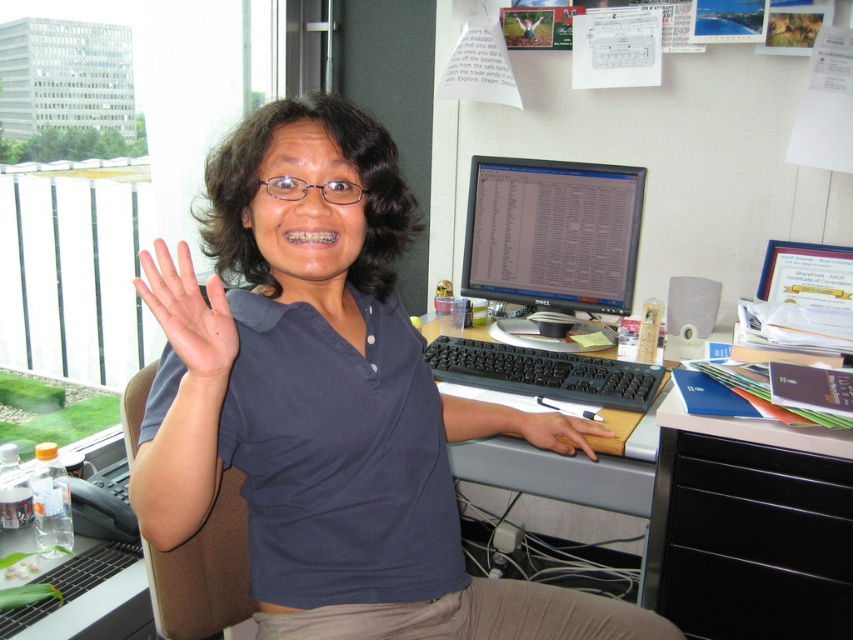
Question: Which point is farther to the camera?

Choices:
 (A) (142, 381)
 (B) (525, 440)

Answer: (B)

Question: Can you confirm if black plastic file cabinet at right is thinner than brown leather hand at lower center?

Choices:
 (A) no
 (B) yes

Answer: (A)

Question: Estimate the real-world distances between objects in this image. Which object is closer to the black plastic keyboard at center?

Choices:
 (A) black matte monitor at center
 (B) matte skin hand at center
 (C) dark blue shirt at center

Answer: (A)

Question: Which point is farther to the camera?

Choices:
 (A) (184, 404)
 (B) (84, 566)
 (C) (224, 547)
 (D) (474, 257)

Answer: (D)

Question: Is dark blue shirt at center bigger than matte skin hand at center?

Choices:
 (A) yes
 (B) no

Answer: (A)

Question: Is black plastic file cabinet at right further to the viewer compared to black plastic keyboard at center?

Choices:
 (A) yes
 (B) no

Answer: (B)